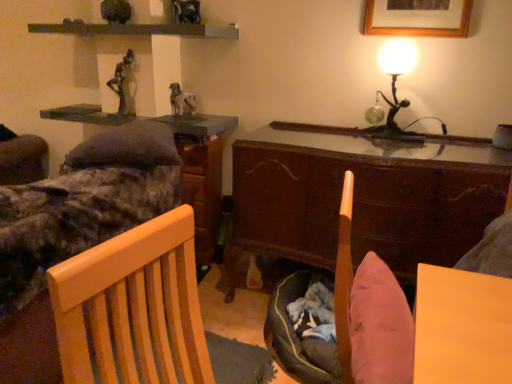
Question: Does bronze statue at upper center have a larger size compared to wooden file cabinet at center?

Choices:
 (A) no
 (B) yes

Answer: (A)

Question: Considering the relative sizes of bronze statue at upper center and wooden file cabinet at center in the image provided, is bronze statue at upper center taller than wooden file cabinet at center?

Choices:
 (A) yes
 (B) no

Answer: (B)

Question: Is bronze statue at upper center not within wooden file cabinet at center?

Choices:
 (A) no
 (B) yes

Answer: (B)

Question: Is bronze statue at upper center shorter than wooden file cabinet at center?

Choices:
 (A) no
 (B) yes

Answer: (B)

Question: Is bronze statue at upper center facing away from wooden file cabinet at center?

Choices:
 (A) yes
 (B) no

Answer: (B)

Question: Considering the positions of point (375, 251) and point (188, 112), is point (375, 251) closer or farther from the camera than point (188, 112)?

Choices:
 (A) closer
 (B) farther

Answer: (A)

Question: Is wooden cabinet at center inside the boundaries of furry white dog at center, or outside?

Choices:
 (A) outside
 (B) inside

Answer: (A)

Question: Would you say wooden cabinet at center is to the left or to the right of furry white dog at center in the picture?

Choices:
 (A) left
 (B) right

Answer: (B)

Question: Is wooden cabinet at center taller or shorter than furry white dog at center?

Choices:
 (A) tall
 (B) short

Answer: (A)

Question: From a real-world perspective, is wooden cabinet at center above or below wooden bed frame at left?

Choices:
 (A) below
 (B) above

Answer: (B)

Question: Considering the relative positions of wooden cabinet at center and wooden bed frame at left in the image provided, is wooden cabinet at center to the left or to the right of wooden bed frame at left?

Choices:
 (A) left
 (B) right

Answer: (B)

Question: Is wooden cabinet at center wider or thinner than wooden bed frame at left?

Choices:
 (A) wide
 (B) thin

Answer: (B)

Question: Considering the positions of point (275, 134) and point (27, 271), is point (275, 134) closer or farther from the camera than point (27, 271)?

Choices:
 (A) closer
 (B) farther

Answer: (B)

Question: From the image's perspective, relative to bronze statue at upper center, is wooden picture frame at upper right above or below?

Choices:
 (A) below
 (B) above

Answer: (B)

Question: Considering the relative positions of wooden picture frame at upper right and bronze statue at upper center in the image provided, is wooden picture frame at upper right to the left or to the right of bronze statue at upper center?

Choices:
 (A) left
 (B) right

Answer: (B)